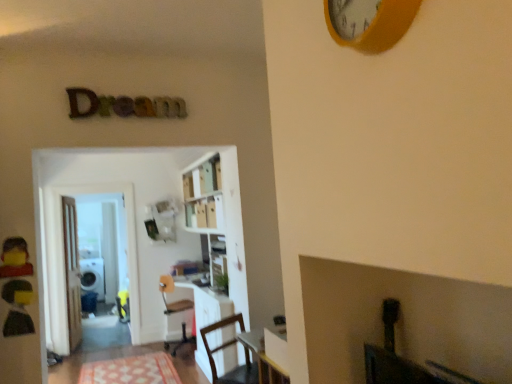
Question: Considering their positions, is yellow matte clock at upper center located in front of or behind transparent glass door at left?

Choices:
 (A) front
 (B) behind

Answer: (A)

Question: Is yellow matte clock at upper center bigger or smaller than transparent glass door at left?

Choices:
 (A) small
 (B) big

Answer: (A)

Question: Which object is the farthest from the matte white chair at center, which appears as the first chair when viewed from the back?

Choices:
 (A) yellow matte clock at upper center
 (B) transparent glass door at left
 (C) patterned fabric mat at lower center
 (D) white glossy bookcase at center
 (E) wooden door at left

Answer: (A)

Question: Considering the real-world distances, which object is closest to the yellow matte clock at upper center?

Choices:
 (A) patterned fabric mat at lower center
 (B) matte white chair at center, which is counted as the second chair, starting from the front
 (C) wooden chair at lower center, acting as the 1th chair starting from the right
 (D) white glossy bookcase at center
 (E) transparent glass door at left

Answer: (C)